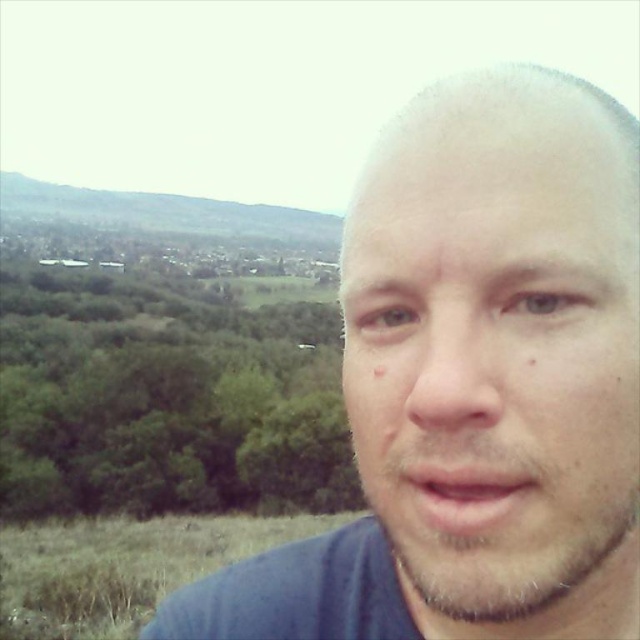
Question: Which object appears farthest from the camera in this image?

Choices:
 (A) green grassy hillside at upper left
 (B) pale skin face at center

Answer: (A)

Question: Which object is closer to the camera taking this photo?

Choices:
 (A) pale skin face at center
 (B) green grassy hillside at upper left

Answer: (A)

Question: Is pale skin face at center closer to the viewer compared to green grassy hillside at upper left?

Choices:
 (A) no
 (B) yes

Answer: (B)

Question: Is pale skin face at center to the right of green grassy hillside at upper left from the viewer's perspective?

Choices:
 (A) no
 (B) yes

Answer: (B)

Question: Does pale skin face at center appear on the right side of green grassy hillside at upper left?

Choices:
 (A) yes
 (B) no

Answer: (A)